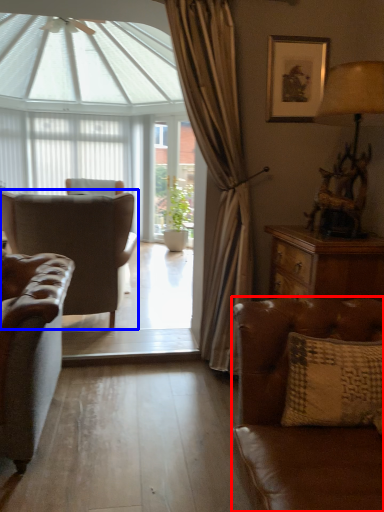
Question: Which of the following is the closest to the observer, studio couch (highlighted by a red box) or chair (highlighted by a blue box)?

Choices:
 (A) studio couch
 (B) chair

Answer: (A)